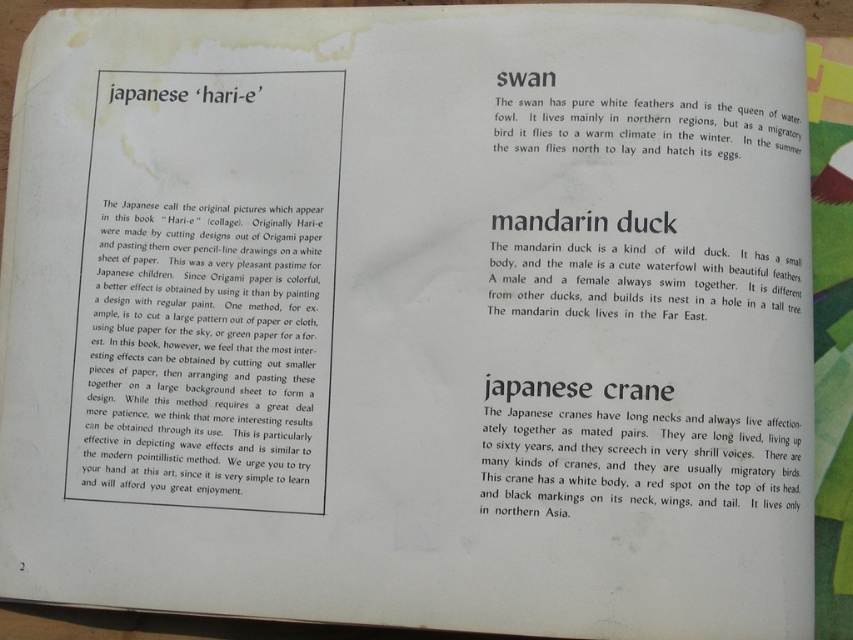
Between point (231, 404) and point (573, 108), which one is positioned behind?

Point (231, 404)

Does point (219, 440) come closer to viewer compared to point (515, 115)?

Yes, it is.

In order to click on white paper at upper left in this screenshot , I will do `click(202, 355)`.

The width and height of the screenshot is (853, 640). I want to click on white paper at upper left, so [x=202, y=355].